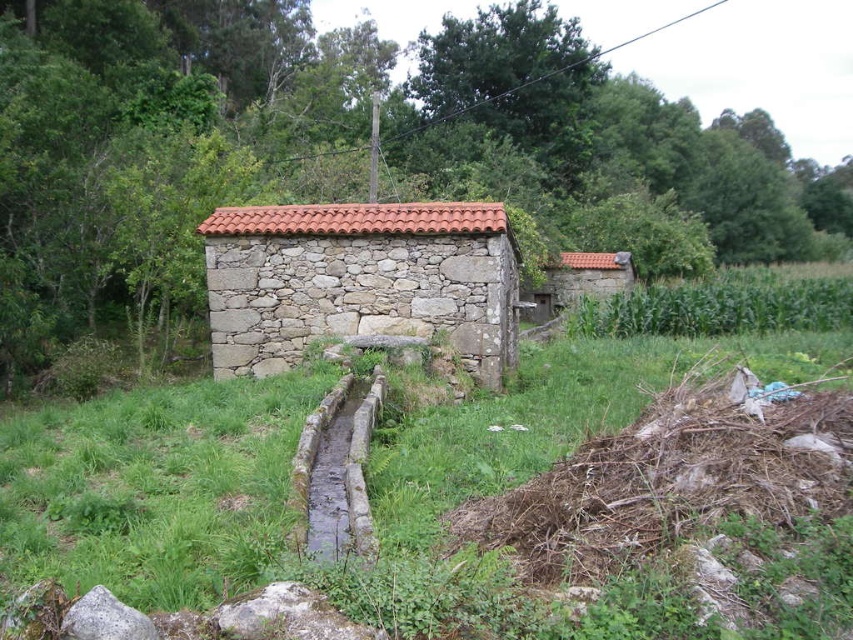
You are a farmer standing in the middle of your property. You notice the stone textured hut at center and the green grassy corn field at right. Which object is taller?

The green grassy corn field at right is taller than the stone textured hut at center.

You are a farmer planning to plant new crops. You have a limited amount of seeds and want to choose the area that requires less space. Which area between the stone textured hut at center and the green grassy corn field at right should you choose?

The stone textured hut at center occupies less space than the green grassy corn field at right, so you should choose the stone textured hut at center for planting since it requires less space.